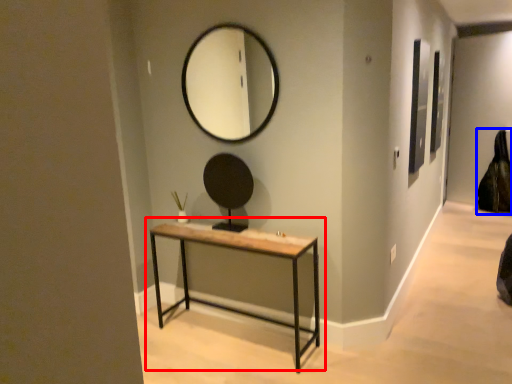
Question: Among these objects, which one is nearest to the camera, table (highlighted by a red box) or swivel chair (highlighted by a blue box)?

Choices:
 (A) table
 (B) swivel chair

Answer: (A)